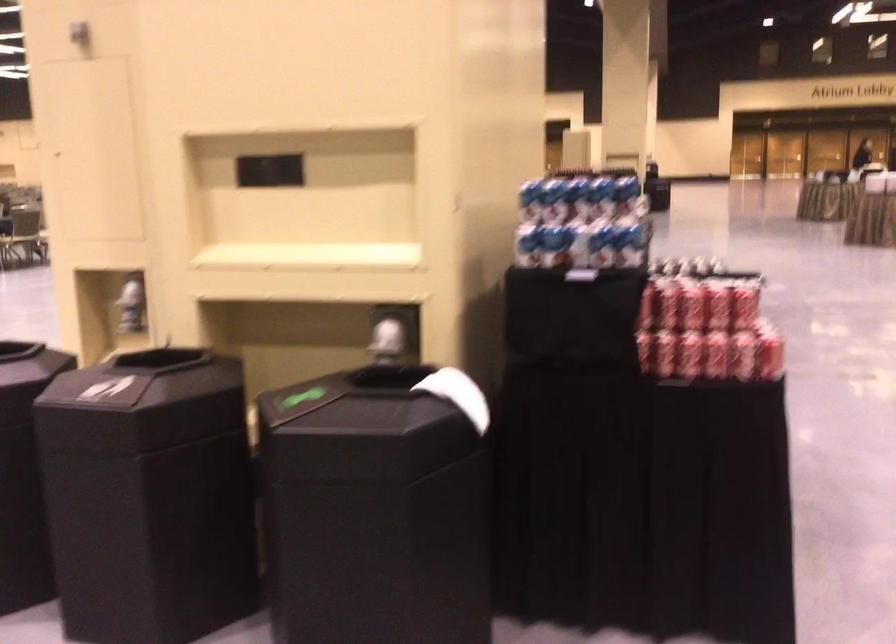
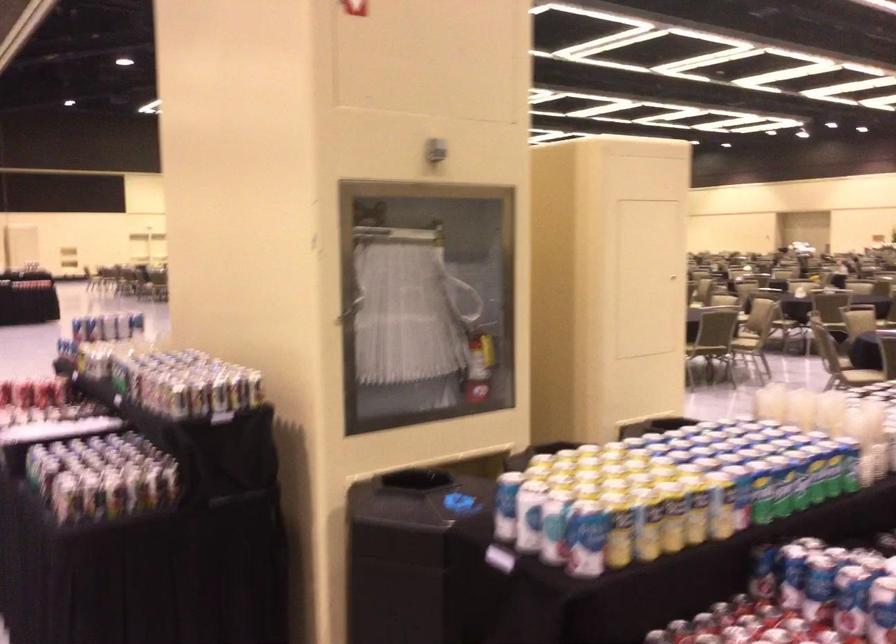
Question: I am providing you with two images of the same scene from different viewpoints. Please identify which objects are invisible in image2.

Choices:
 (A) trash can opening
 (B) blue and white can
 (C) small window handle
 (D) small beverage bottle

Answer: (B)